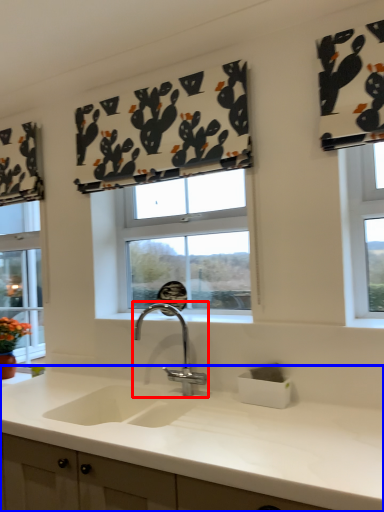
Question: Which point is closer to the camera, tap (highlighted by a red box) or countertop (highlighted by a blue box)?

Choices:
 (A) tap
 (B) countertop

Answer: (B)